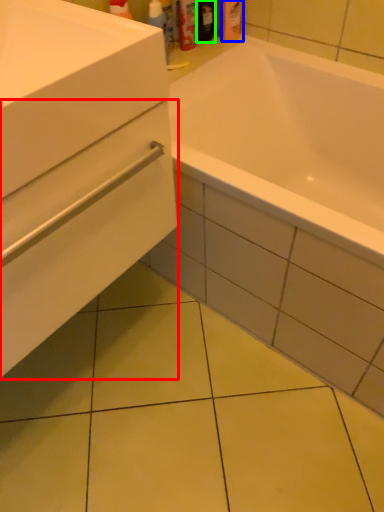
Question: Estimate the real-world distances between objects in this image. Which object is closer to drawer (highlighted by a red box), toiletry (highlighted by a blue box) or toiletry (highlighted by a green box)?

Choices:
 (A) toiletry
 (B) toiletry

Answer: (B)